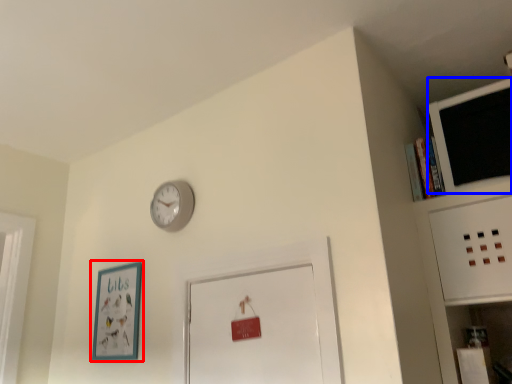
Question: Which object is closer to the camera taking this photo, picture frame (highlighted by a red box) or computer monitor (highlighted by a blue box)?

Choices:
 (A) picture frame
 (B) computer monitor

Answer: (B)